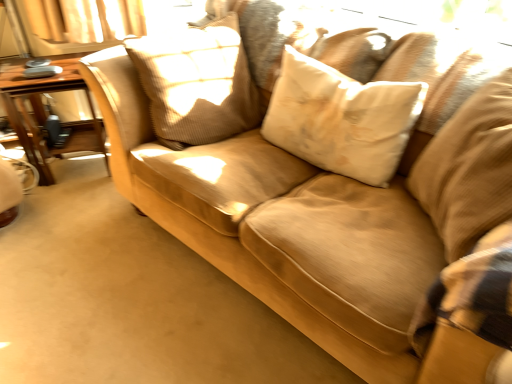
Question: Relative to wooden table at left, is beige textured pillow at center, the third pillow from the right, in front or behind?

Choices:
 (A) front
 (B) behind

Answer: (A)

Question: From a real-world perspective, is beige textured pillow at center, the third pillow from the right, positioned above or below wooden table at left?

Choices:
 (A) below
 (B) above

Answer: (B)

Question: Which object is the closest to the wooden table at left?

Choices:
 (A) beige fabric pillow at right, which is counted as the first pillow, starting from the right
 (B) white soft pillow at center, arranged as the 2th pillow when viewed from the left
 (C) beige textured pillow at center, the 1th pillow from the left

Answer: (C)

Question: Which of these objects is positioned closest to the beige textured pillow at center, the 1th pillow from the left?

Choices:
 (A) white soft pillow at center, arranged as the 2th pillow when viewed from the right
 (B) wooden table at left
 (C) beige fabric pillow at right, which is counted as the first pillow, starting from the right

Answer: (A)